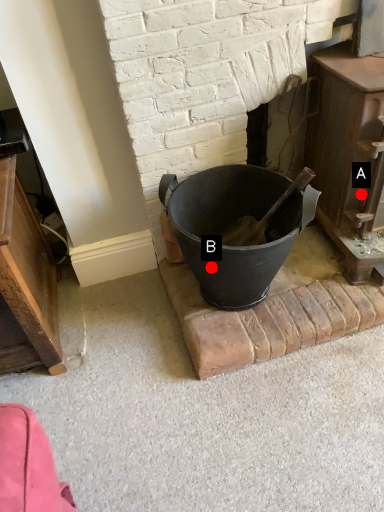
Question: Two points are circled on the image, labeled by A and B beside each circle. Among these points, which one is farthest from the camera?

Choices:
 (A) A is further
 (B) B is further

Answer: (A)